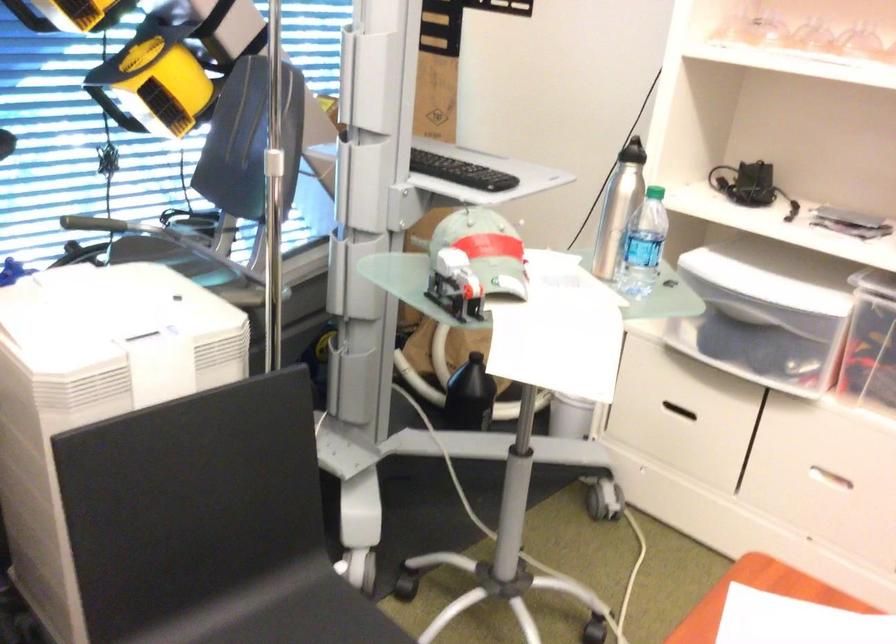
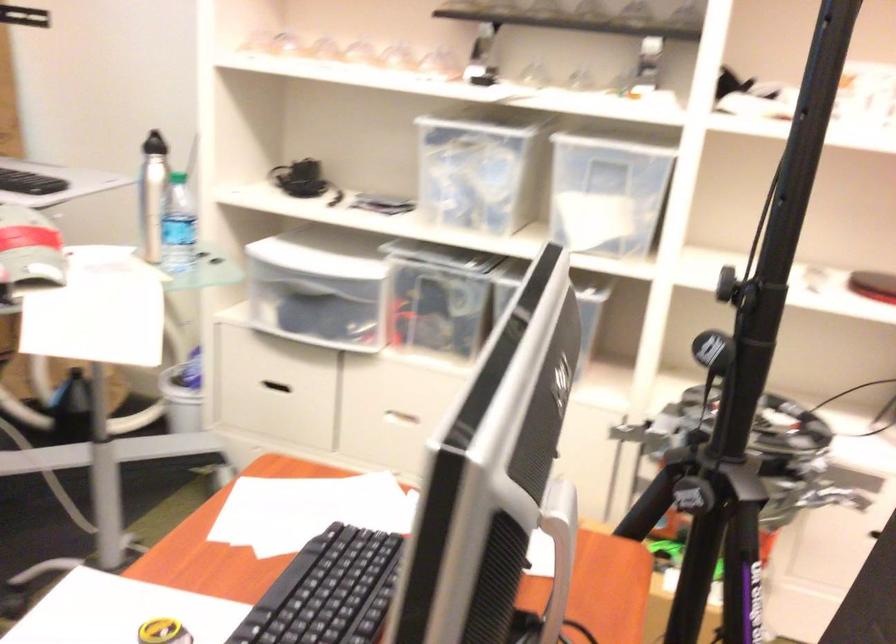
Locate, in the second image, the point that corresponds to the point at 643,242 in the first image.

(177, 225)